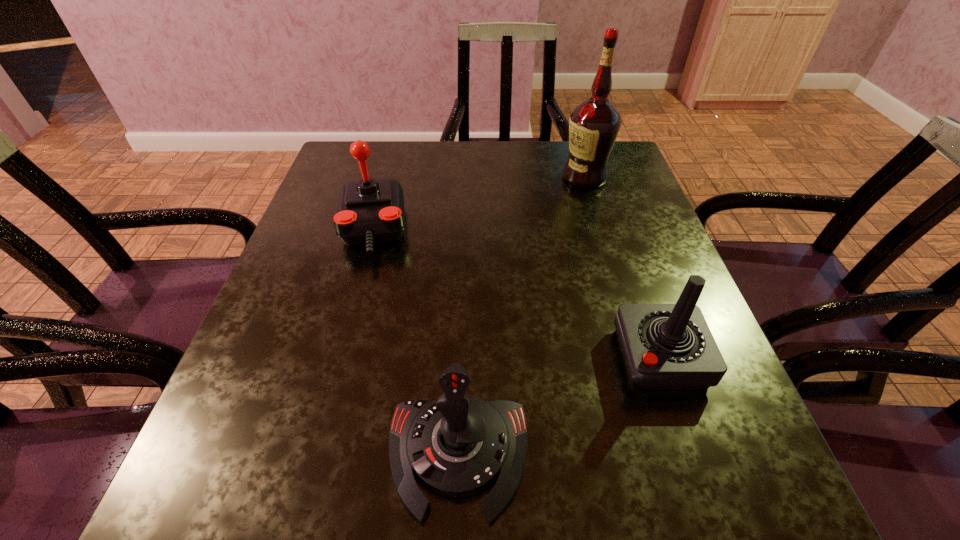
The width and height of the screenshot is (960, 540). In order to click on free space between the second farthest object and the alcohol in this screenshot , I will do `click(478, 203)`.

In order to click on vacant area that lies between the shortest object and the farthest object in this screenshot , I will do `click(521, 316)`.

At what (x,y) coordinates should I click in order to perform the action: click on blank region between the farthest object and the second nearest object. Please return your answer as a coordinate pair (x, y). The height and width of the screenshot is (540, 960). Looking at the image, I should click on (622, 267).

The height and width of the screenshot is (540, 960). Find the location of `vacant space in between the farthest object and the leftmost joystick`. vacant space in between the farthest object and the leftmost joystick is located at coordinates (478, 203).

This screenshot has height=540, width=960. I want to click on free space between the farthest object and the second farthest joystick, so click(x=622, y=267).

At what (x,y) coordinates should I click in order to perform the action: click on free space between the leftmost object and the tallest object. Please return your answer as a coordinate pair (x, y). The height and width of the screenshot is (540, 960). Looking at the image, I should click on (478, 203).

Where is `vacant area that lies between the second farthest joystick and the alcohol`? The width and height of the screenshot is (960, 540). vacant area that lies between the second farthest joystick and the alcohol is located at coordinates (622, 267).

I want to click on object that is the closest one to the tallest object, so click(370, 211).

Find the location of a particular element. The width and height of the screenshot is (960, 540). object that stands as the third closest to the nearest object is located at coordinates (594, 125).

Locate an element on the screen. This screenshot has width=960, height=540. joystick that can be found as the second closest to the second nearest joystick is located at coordinates (370, 211).